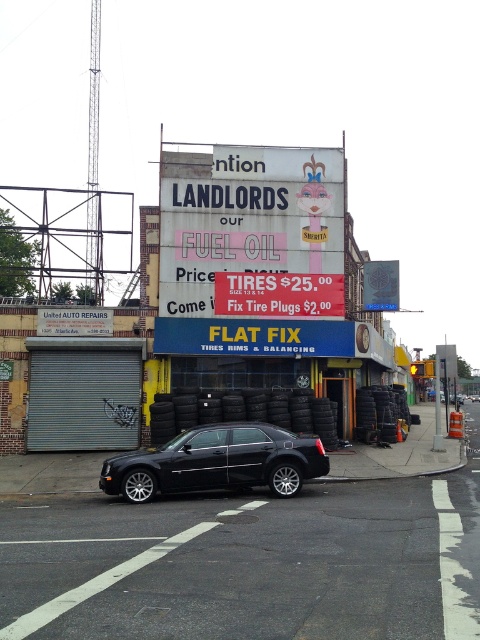
In the scene shown: You are standing on the street looking at the billboard. There are two points marked on the billboard at coordinates point (375, 400) and point (130, 496). Which point is closer to you?

Point (130, 496) is closer to you because it is less further to the viewer than point (375, 400).

You are a delivery person who needs to attach a note to the white paper sign at center and the black rubber tire at lower left. Since you have limited tape, you want to know which object requires less tape to cover its height. Which one is shorter?

The white paper sign at center has a lesser height compared to the black rubber tire at lower left, so it requires less tape to cover its height.

You are a delivery driver who needs to check the position of your tires. You see the black rubber tires at lower center and the black rubber tire at lower left in the image. Which tire is closer to you?

The black rubber tires at lower center are closer to you because the black rubber tire at lower left is behind them, meaning the tires at lower center are in front.